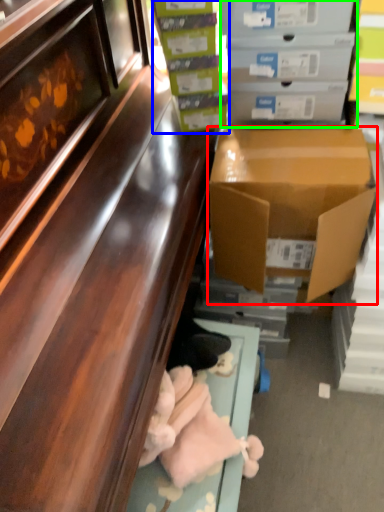
Question: Based on their relative distances, which object is nearer to box (highlighted by a red box)? Choose from box (highlighted by a blue box) and box (highlighted by a green box).

Choices:
 (A) box
 (B) box

Answer: (B)